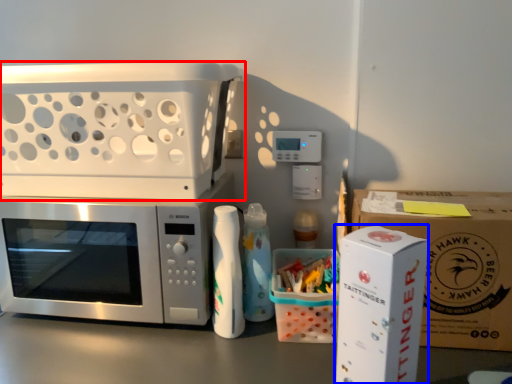
Question: Which point is further to the camera, appliance (highlighted by a red box) or appliance (highlighted by a blue box)?

Choices:
 (A) appliance
 (B) appliance

Answer: (A)